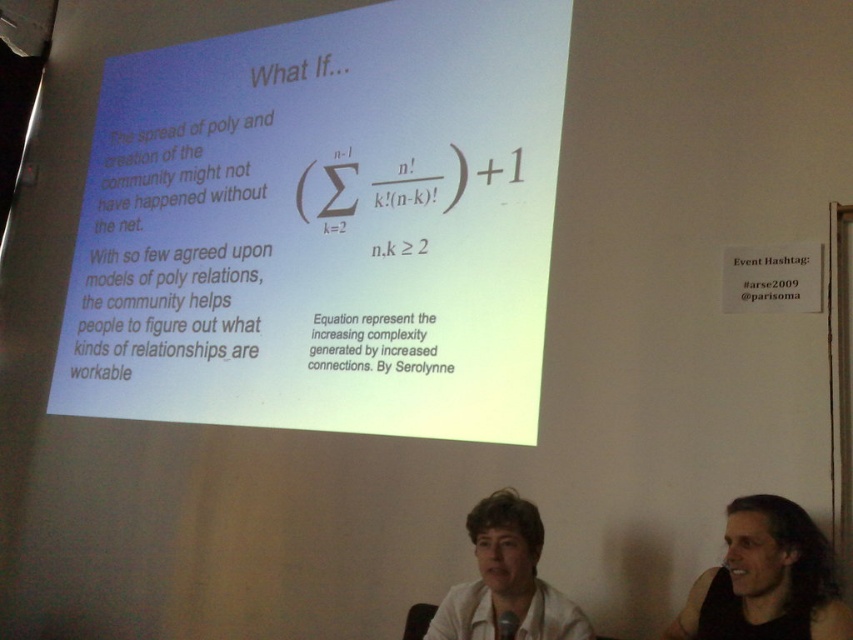
You are a presenter standing at the front of the room. You need to point to the white paper at center during your talk. Where should you direct your audience to look?

The white paper at center is located at point coordinates (323, 225), so you should direct your audience to look there.

You are a presenter standing at the front of the room facing the screen. You notice two points on the slide. The first point is labeled as point (779, 596) and the second is labeled as point (525, 596). Which point appears closer to you as you face the screen?

Point (779, 596) is closer to the camera than point (525, 596), so as the presenter facing the screen, point (779, 596) would appear closer to you.

You are a speaker standing in front of the slide. You notice a white paper at center and a white matte shirt at center. Which object is closer to you?

The white paper at center is closer to you because the white matte shirt at center is behind it.